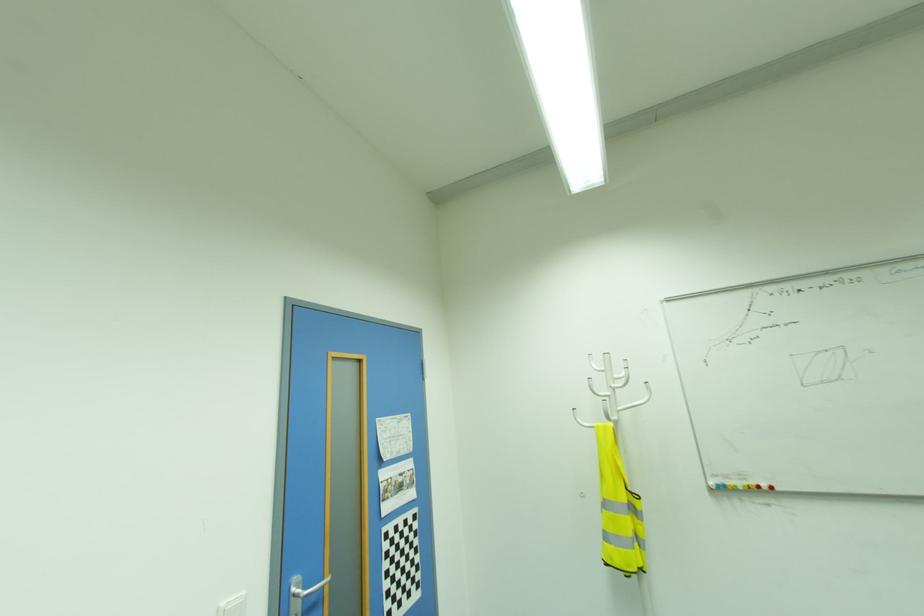
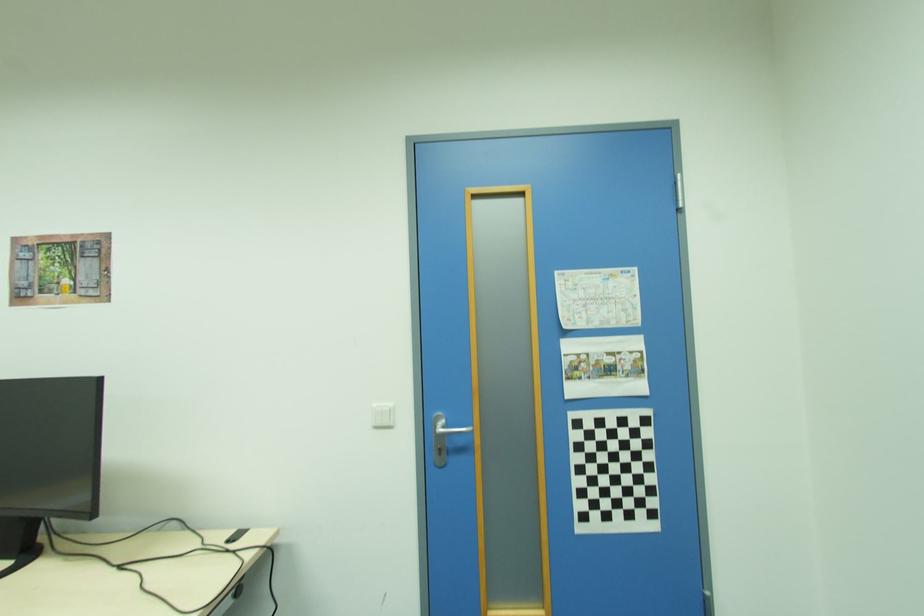
The point at [419,586] is marked in the first image. Where is the corresponding point in the second image?

(655, 515)